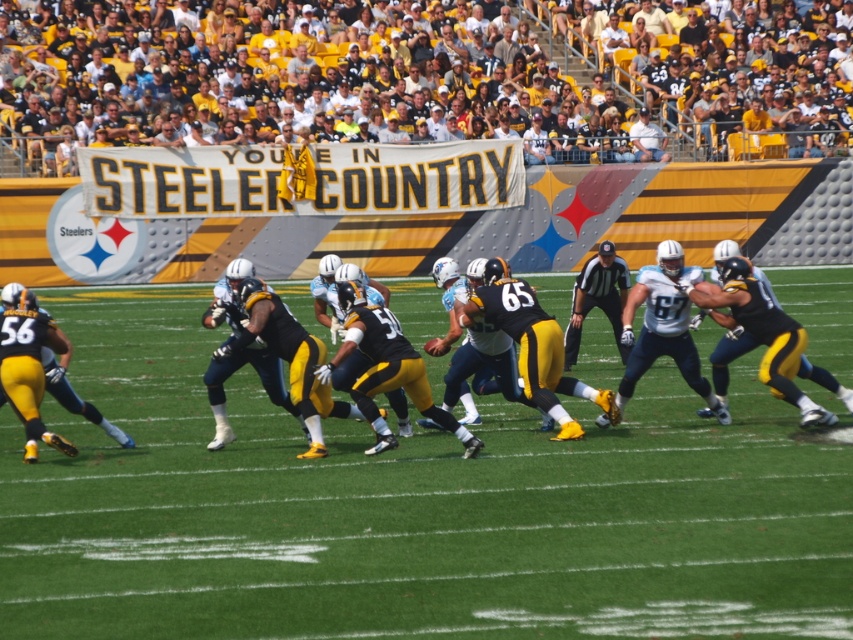
Does green grass at center have a lesser height compared to black matte jersey at center?

In fact, green grass at center may be taller than black matte jersey at center.

Is point (549, 282) less distant than point (343, 269)?

That is False.

Locate an element on the screen. This screenshot has width=853, height=640. green grass at center is located at coordinates (409, 509).